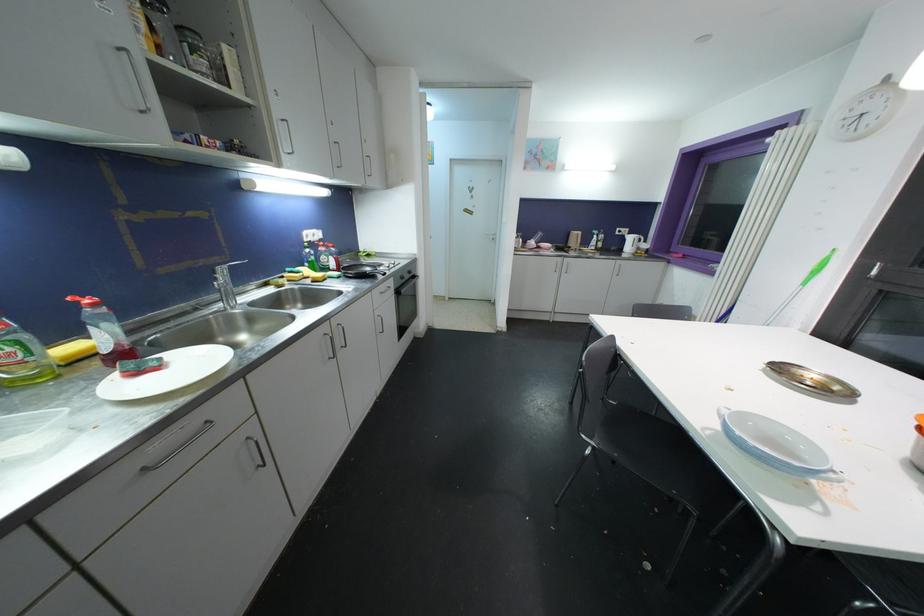
Find where to lift the red soap dispenser. Please return your answer as a coordinate pair (x, y).

(104, 331)